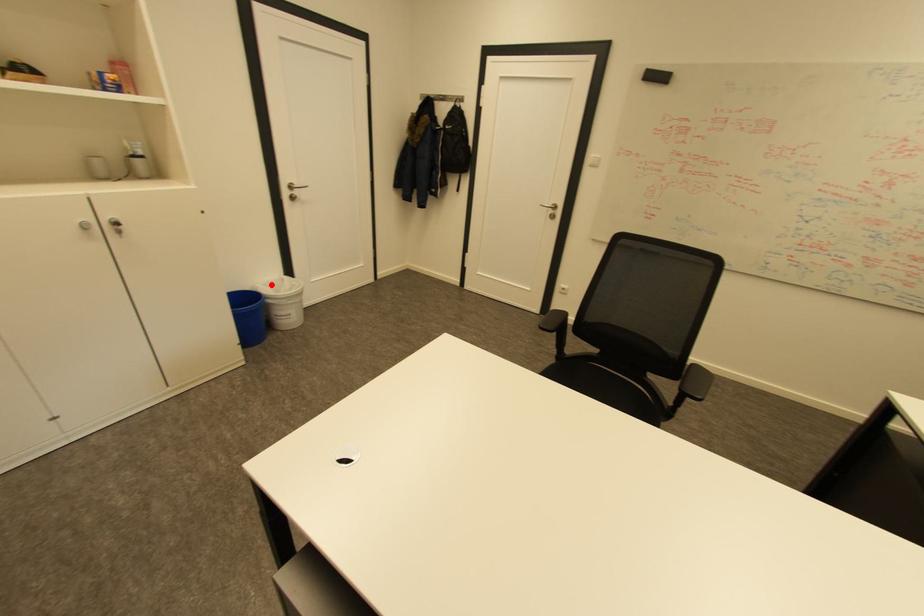
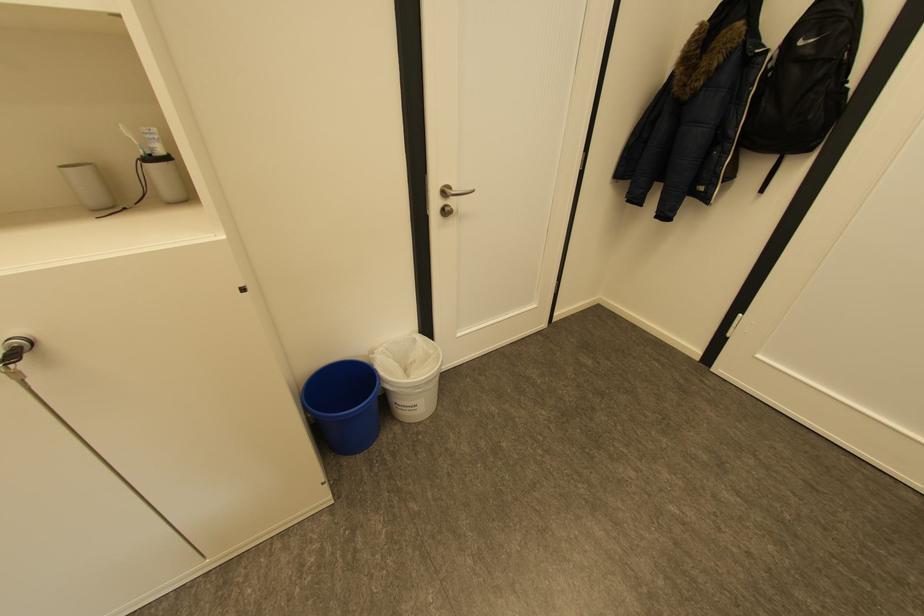
In the second image, find the point that corresponds to the highlighted location in the first image.

(394, 349)